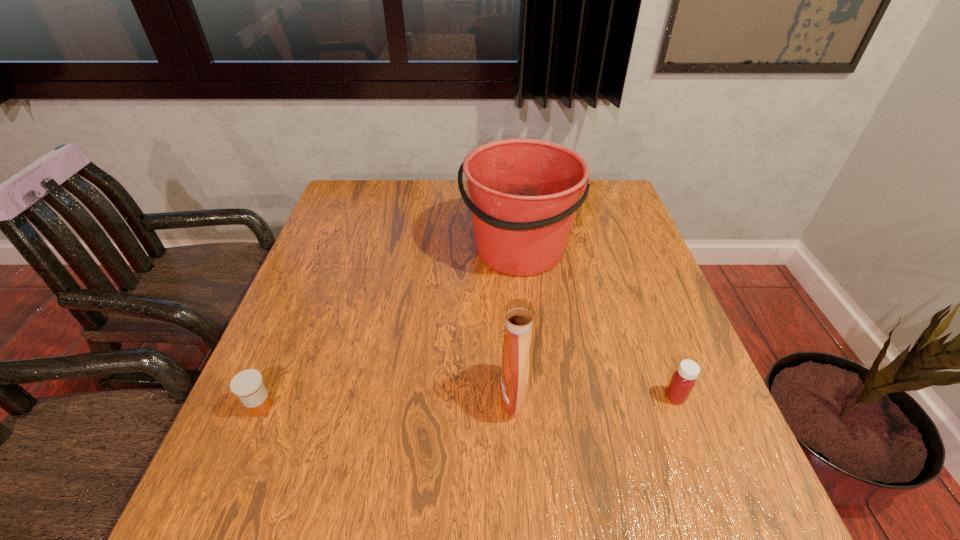
Image resolution: width=960 pixels, height=540 pixels. I want to click on object located at the far edge, so click(x=524, y=193).

The height and width of the screenshot is (540, 960). What are the coordinates of `object located at the left edge` in the screenshot? It's located at (247, 385).

Image resolution: width=960 pixels, height=540 pixels. Find the location of `object present at the right edge`. object present at the right edge is located at coordinates (683, 380).

In the image, there is a desktop. At what (x,y) coordinates should I click in order to perform the action: click on vacant space at the far edge. Please return your answer as a coordinate pair (x, y). Looking at the image, I should click on (426, 206).

Image resolution: width=960 pixels, height=540 pixels. In the image, there is a desktop. What are the coordinates of `free region at the near edge` in the screenshot? It's located at (379, 514).

The image size is (960, 540). I want to click on free space at the left edge, so click(x=374, y=234).

Locate an element on the screen. The width and height of the screenshot is (960, 540). vacant space at the right edge of the desktop is located at coordinates (655, 372).

You are a GUI agent. You are given a task and a screenshot of the screen. Output one action in this format:
    pyautogui.click(x=<x>, y=<y>)
    Task: Click on the free space at the near left corner of the desktop
    The image size is (960, 540).
    Given the screenshot: What is the action you would take?
    pyautogui.click(x=219, y=488)

In the image, there is a desktop. What are the coordinates of `vacant area at the far right corner` in the screenshot? It's located at (589, 219).

This screenshot has width=960, height=540. I want to click on free space at the near right corner, so click(x=725, y=488).